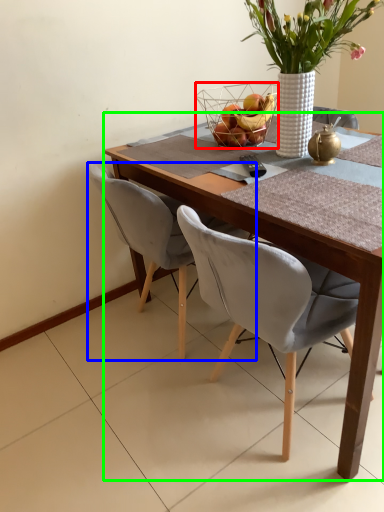
Question: Which is farther away from basket (highlighted by a red box)? chair (highlighted by a blue box) or round table (highlighted by a green box)?

Choices:
 (A) chair
 (B) round table

Answer: (B)